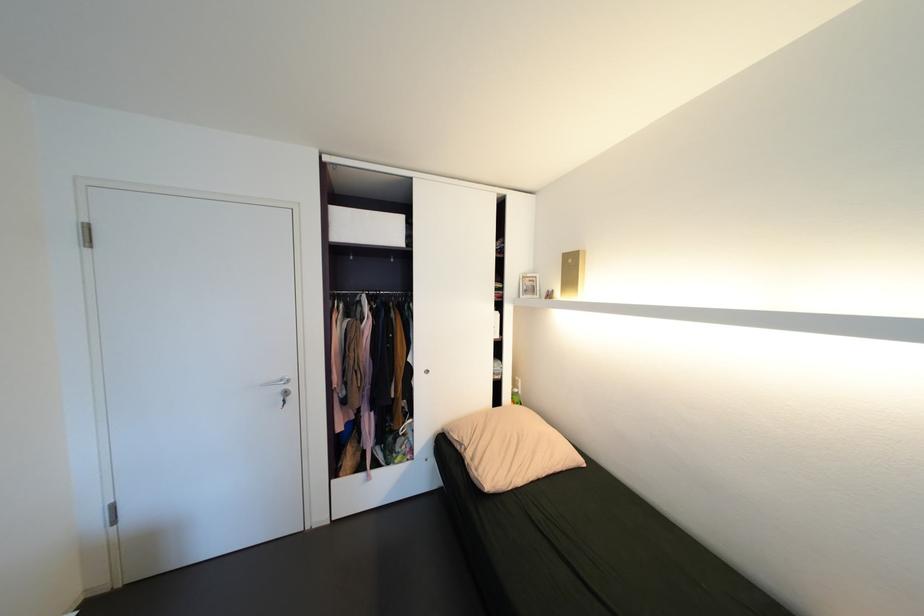
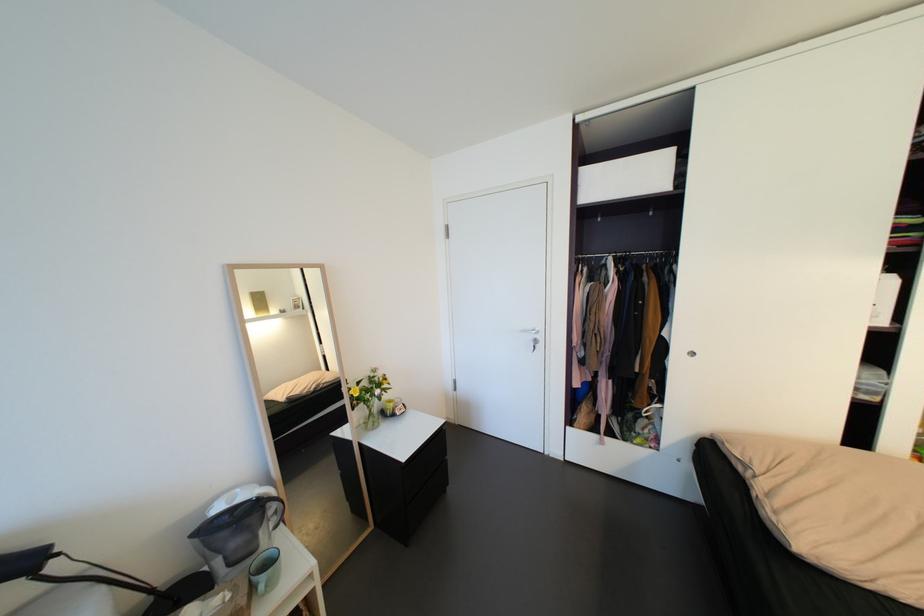
Find the pixel in the second image that matches (x=440, y=461) in the first image.

(697, 467)